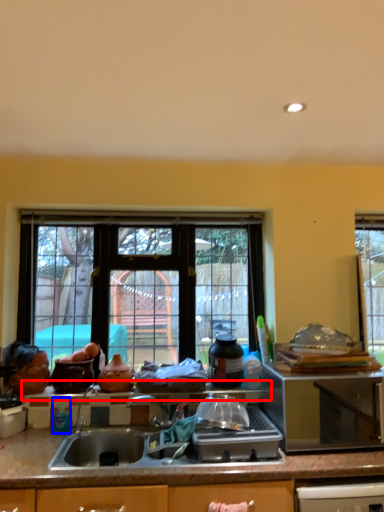
Question: Which object appears closest to the camera in this image, window sill (highlighted by a red box) or bottle (highlighted by a blue box)?

Choices:
 (A) window sill
 (B) bottle

Answer: (B)